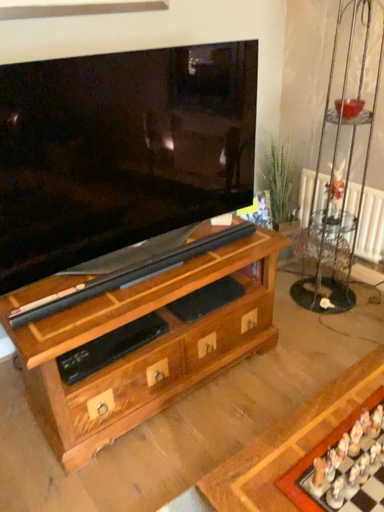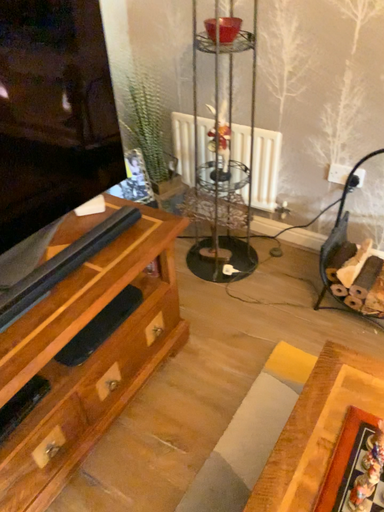
Question: Which way did the camera rotate in the video?

Choices:
 (A) rotated upward
 (B) rotated downward

Answer: (B)